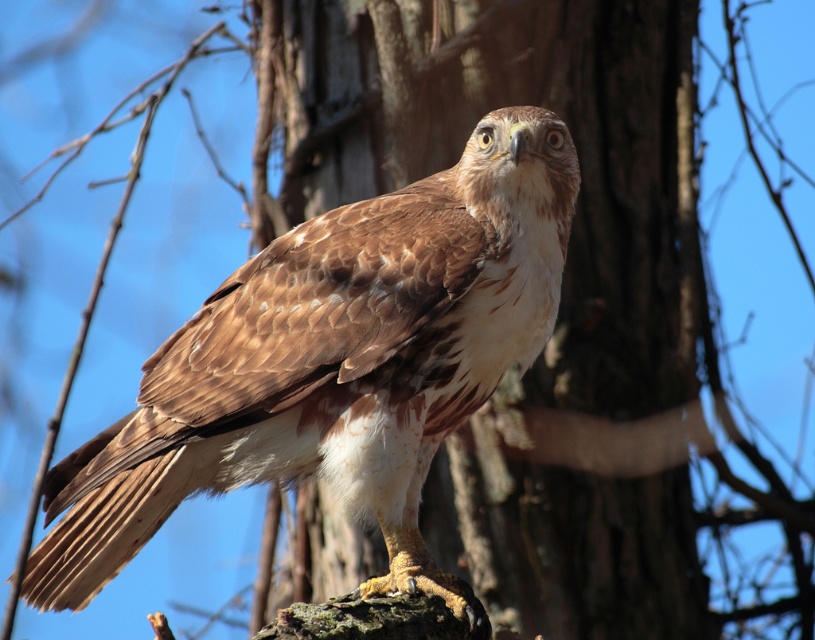
Does brown rough bark at center appear under brown feathered eagle at center?

Incorrect, brown rough bark at center is not positioned below brown feathered eagle at center.

Does brown rough bark at center appear on the left side of brown feathered eagle at center?

In fact, brown rough bark at center is to the right of brown feathered eagle at center.

I want to click on brown rough bark at center, so click(x=562, y=288).